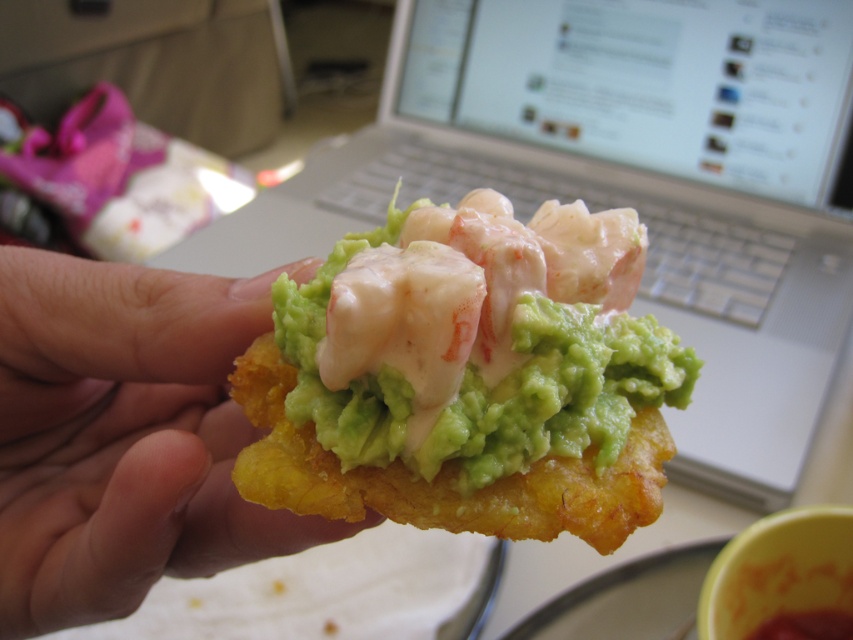
You are preparing to take a photo of the golden fried chip at center and the green creamy guacamole at center for a food blog. To ensure both are visible in the frame, which one should you focus on first when adjusting the camera angle?

The green creamy guacamole at center is not as tall as the golden fried chip at center, so you should focus on the golden fried chip at center first to ensure both are visible in the frame.

You are organizing a desk and need to place the silver metallic laptop at upper center and the golden fried chip at center. Given their sizes, which object should you place first to ensure both fit on the desk?

The silver metallic laptop at upper center should be placed first because it is taller than the golden fried chip at center, ensuring there is enough space for both items on the desk.

Looking at this image, you are preparing a snack and want to place both the green creamy guacamole at center and the golden fried chip at center onto a small plate. Which item should you place first to ensure both fit comfortably?

The green creamy guacamole at center is smaller than the golden fried chip at center, so you should place the golden fried chip at center first to ensure there is enough space for the smaller guacamole.